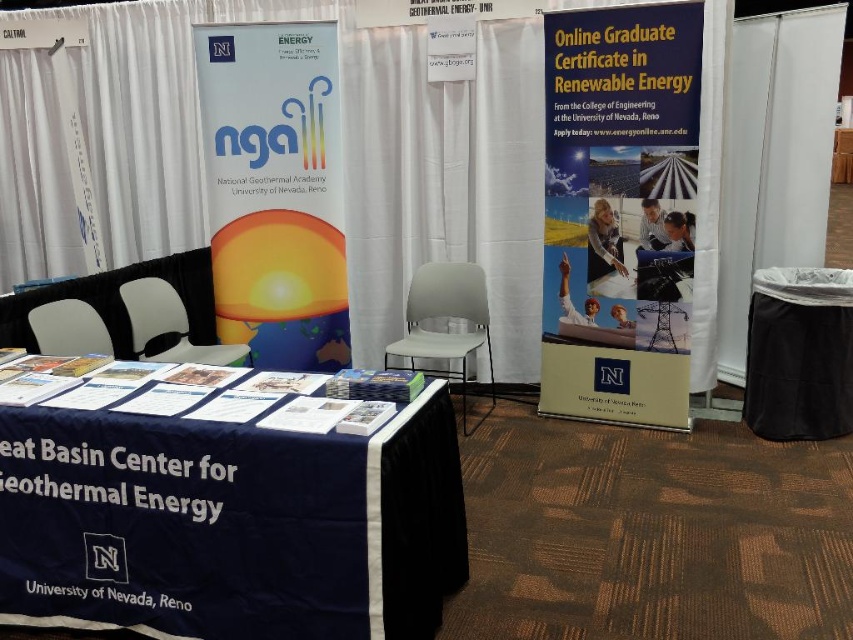
You are an attendee at the conference, and you want to pick up a brochure from the blue fabric table at lower left. However, there is a yellow matte sign at center in the way. Can you reach the table without moving the sign?

The blue fabric table at lower left has a lesser height compared to the yellow matte sign at center. Since the table is shorter, you can reach it by bending down or moving around the sign to access the table.